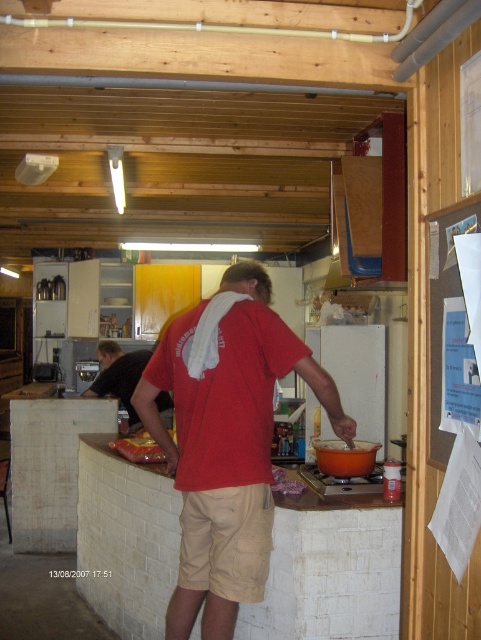
Question: Is red matte shirt at center thinner than white paperboard at right?

Choices:
 (A) yes
 (B) no

Answer: (B)

Question: Which object is the farthest from the shiny plastic bag at counter left?

Choices:
 (A) red matte shirt at center
 (B) white paperboard at right

Answer: (B)

Question: Which object is closer to the camera taking this photo?

Choices:
 (A) shiny plastic bag at counter left
 (B) white paperboard at right
 (C) red matte shirt at center
 (D) black cotton shirt at left

Answer: (B)

Question: Can you confirm if red matte shirt at center is smaller than black cotton shirt at left?

Choices:
 (A) no
 (B) yes

Answer: (B)

Question: Estimate the real-world distances between objects in this image. Which object is farther from the black cotton shirt at left?

Choices:
 (A) shiny plastic bag at counter left
 (B) red matte shirt at center

Answer: (B)

Question: In this image, where is black cotton shirt at left located relative to shiny plastic bag at counter left?

Choices:
 (A) above
 (B) below

Answer: (A)